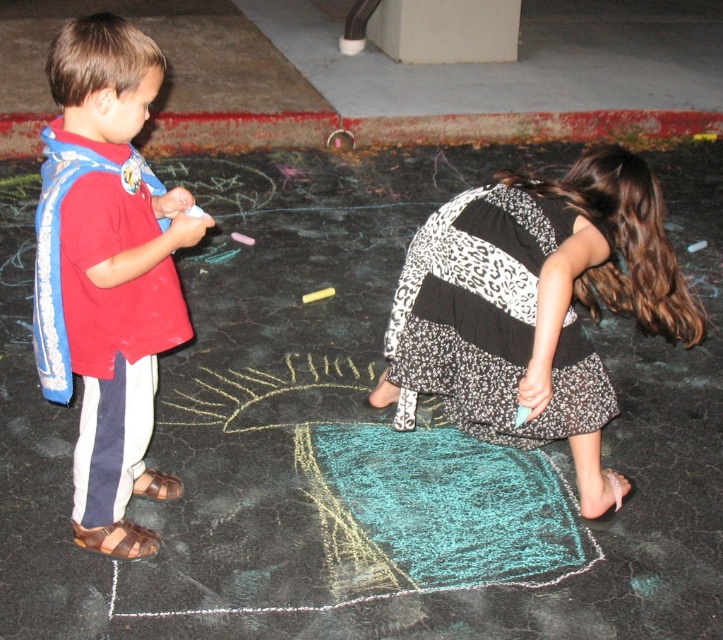
Does point (64, 196) come farther from viewer compared to point (333, 292)?

That is False.

Between matte red shirt at left and yellow chalk at center, which one appears on the right side from the viewer's perspective?

yellow chalk at center

Image resolution: width=723 pixels, height=640 pixels. In order to click on matte red shirt at left in this screenshot , I will do `click(114, 268)`.

Does printed fabric dress at lower right appear under matte red shirt at left?

Indeed, printed fabric dress at lower right is positioned under matte red shirt at left.

How far apart are printed fabric dress at lower right and matte red shirt at left?

They are 34.94 inches apart.

Between point (594, 163) and point (98, 179), which one is positioned behind?

The point (594, 163) is behind.

Identify the location of printed fabric dress at lower right. 536,305.

Can you confirm if printed fabric dress at lower right is positioned to the left of yellow chalk at center?

No, printed fabric dress at lower right is not to the left of yellow chalk at center.

Who is more forward, (x=510, y=330) or (x=320, y=292)?

Point (x=510, y=330) is in front.

The width and height of the screenshot is (723, 640). In order to click on printed fabric dress at lower right in this screenshot , I will do `click(536, 305)`.